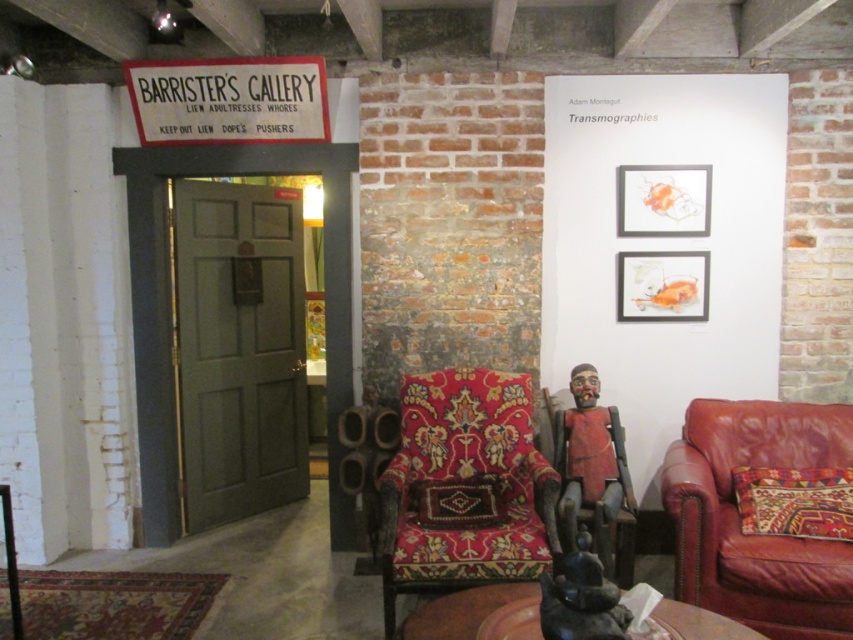
You are an art enthusiast visiting the gallery and want to sit down to rest. There is a wooden armchair at center and a matte silver picture frame at upper right. Which object is taller?

The wooden armchair at center is taller than the matte silver picture frame at upper right.